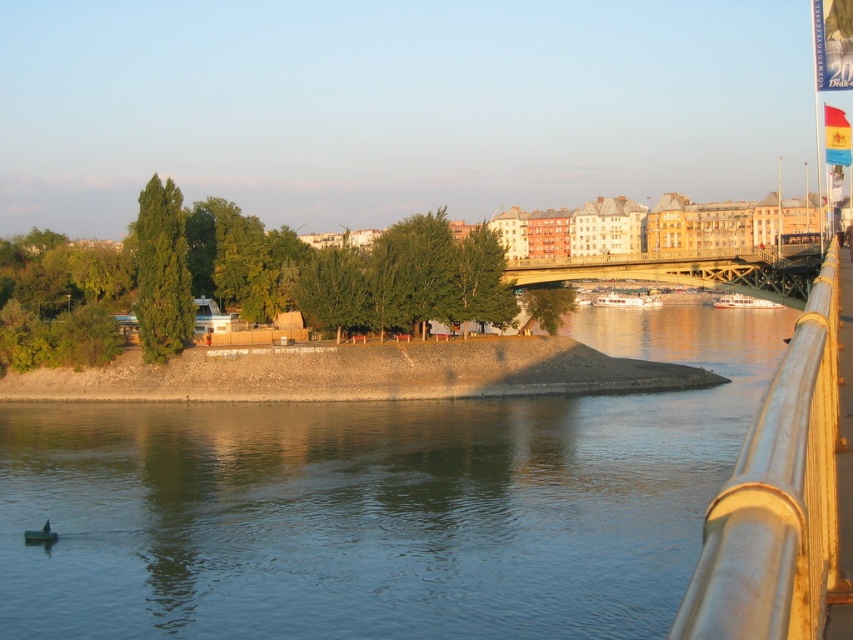
Question: Which object is closer to the camera taking this photo?

Choices:
 (A) metallic yellow railing at right
 (B) gold metallic bridge at center
 (C) blue water at lower left

Answer: (A)

Question: Is blue water at lower left behind gold metallic bridge at center?

Choices:
 (A) no
 (B) yes

Answer: (A)

Question: Which of the following is the farthest from the observer?

Choices:
 (A) gold metallic bridge at center
 (B) metallic yellow railing at right
 (C) blue water at lower left

Answer: (A)

Question: Can you confirm if blue water at lower left is positioned above gold metallic bridge at center?

Choices:
 (A) no
 (B) yes

Answer: (A)

Question: Can you confirm if blue water at lower left is smaller than gold metallic bridge at center?

Choices:
 (A) yes
 (B) no

Answer: (B)

Question: Considering the real-world distances, which object is closest to the metallic yellow railing at right?

Choices:
 (A) blue water at lower left
 (B) gold metallic bridge at center

Answer: (A)